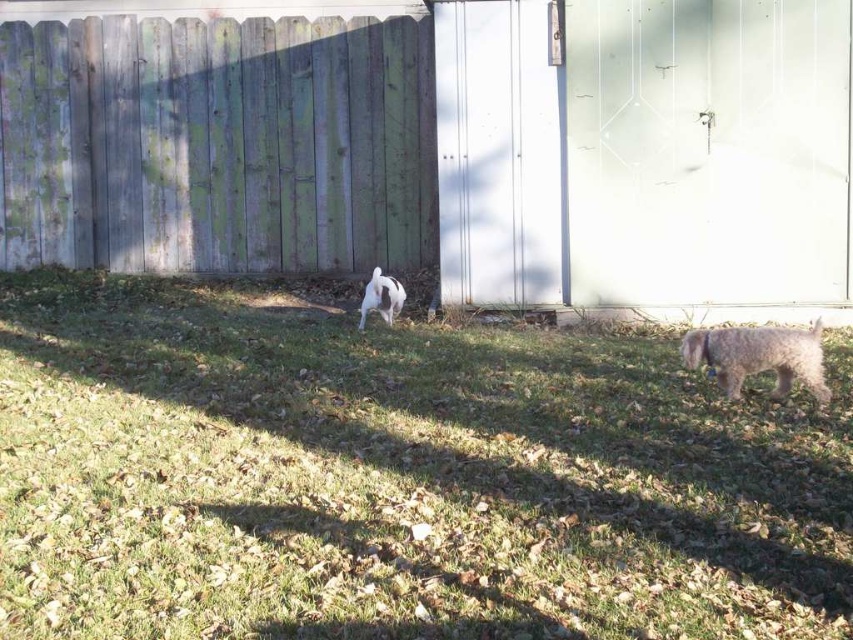
You are standing in the backyard looking at the scene. There is a point at coordinate (396,477). What is located at that point?

The point at coordinate (396,477) indicates green grass at center.

You are a small robot with a 3 feet wide body. You are in the backyard and need to move from the green grass at center to the white fur dog at center. Can you navigate the space between them without any obstacles?

The distance between the green grass at center and the white fur dog at center is 9.52 feet. Since your robot is 3 feet wide, there is enough space to move between them without any issues.

You are standing at the edge of the grassy area and want to throw a ball to the fuzzy gray dog at lower right. The ball you have is 2 meters in diameter. If you place the ball on the green grass at center, will it block the dog from seeing you? Please explain your reasoning.

The green grass at center is 2.35 meters away from the fuzzy gray dog at lower right. Since the ball is only 2 meters in diameter, placing it there would leave a gap of 0.35 meters between the ball and the dog. This distance might be too small for the dog to comfortably navigate around the ball to see you, but the ball itself would block part of the dog s view depending on its position. However, since the ball is not between you and the dog, but placed on the grass at center, the dog could still see you as